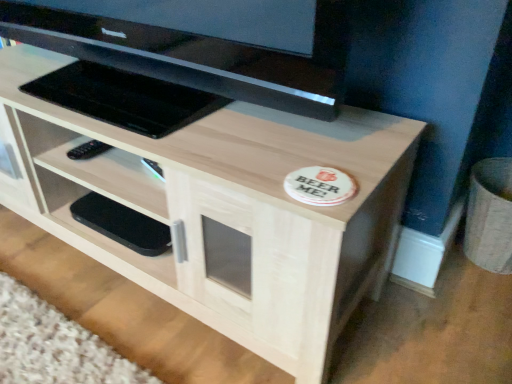
Question: Relative to black glossy television at upper center, is black matte phone at lower left in front or behind?

Choices:
 (A) front
 (B) behind

Answer: (B)

Question: In the image, is black matte phone at lower left on the left side or the right side of black glossy television at upper center?

Choices:
 (A) left
 (B) right

Answer: (A)

Question: Considering the real-world distances, which object is closest to the black glossy television at upper center?

Choices:
 (A) black matte phone at lower left
 (B) light wood/texture tv stand at center

Answer: (B)

Question: Which is nearer to the black matte phone at lower left?

Choices:
 (A) black glossy television at upper center
 (B) light wood/texture tv stand at center

Answer: (B)